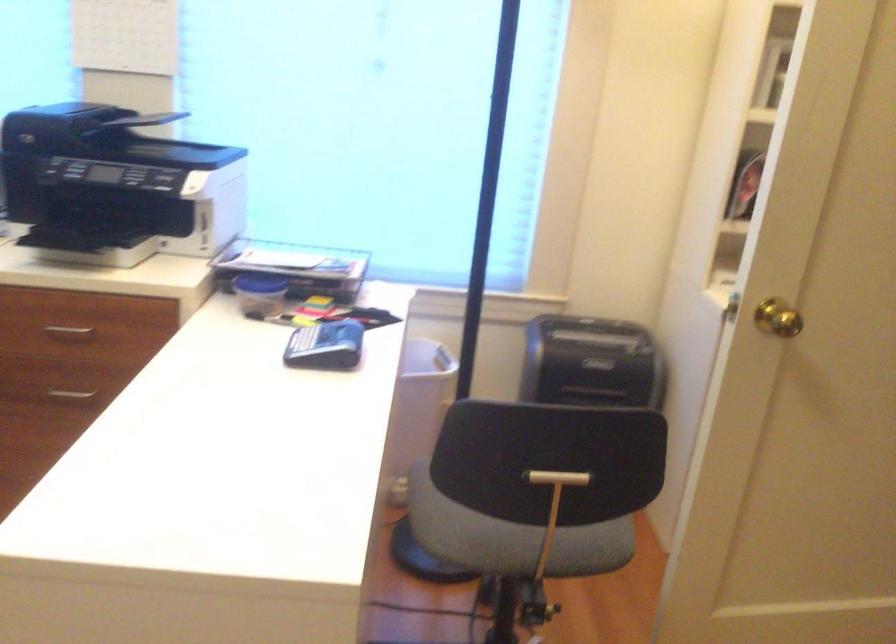
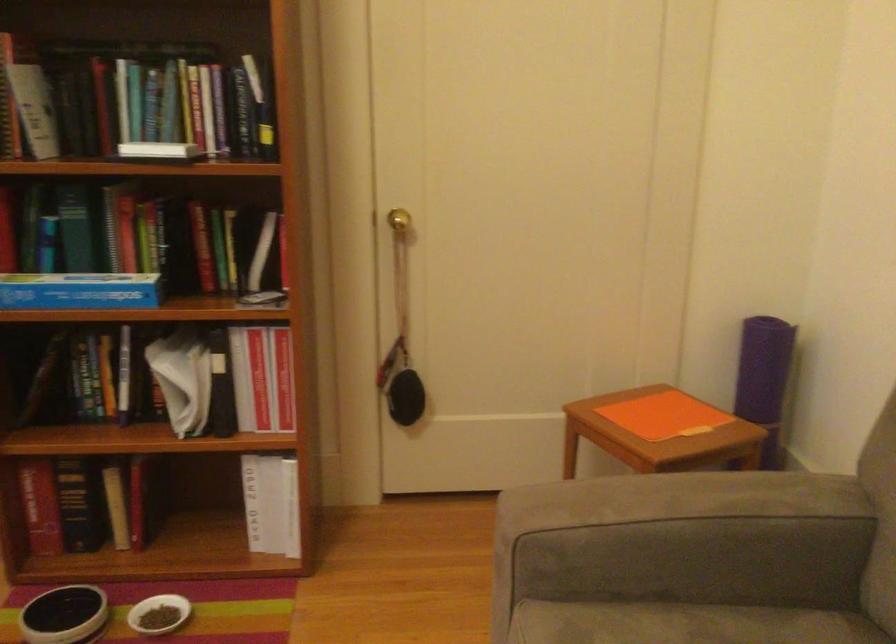
Based on the continuous images, in which direction is the camera rotating?

The camera's rotation is toward right-down.